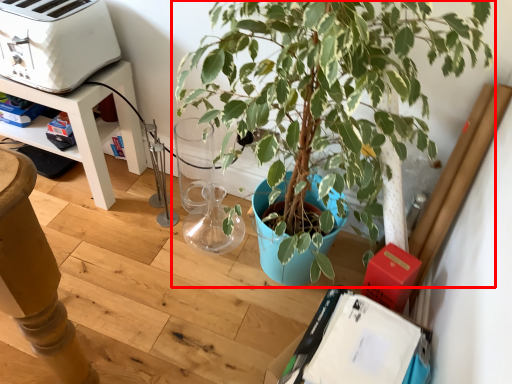
Question: From the image's perspective, what is the correct spatial positioning of houseplant (annotated by the red box) in reference to appliance?

Choices:
 (A) below
 (B) above

Answer: (A)